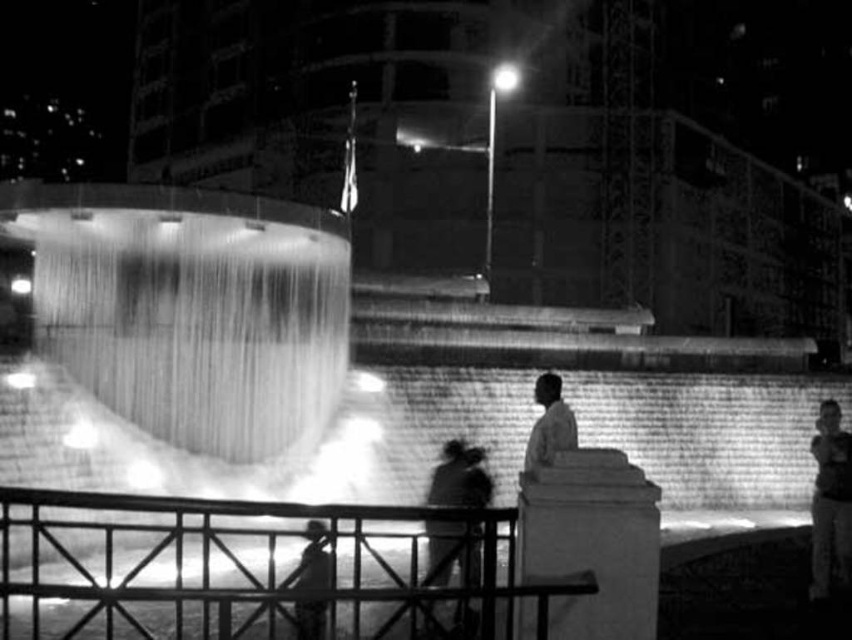
From the picture: Is translucent glass water at center smaller than smooth skin face at right?

Yes.

What do you see at coordinates (191, 308) in the screenshot? I see `translucent glass water at center` at bounding box center [191, 308].

Who is more forward, (x=125, y=385) or (x=827, y=477)?

Point (x=827, y=477) is more forward.

The height and width of the screenshot is (640, 852). In order to click on translucent glass water at center in this screenshot , I will do `click(191, 308)`.

Does smooth skin face at right appear over silhouette fabric at lower center?

Indeed, smooth skin face at right is positioned over silhouette fabric at lower center.

Does smooth skin face at right appear under silhouette fabric at lower center?

Incorrect, smooth skin face at right is not positioned below silhouette fabric at lower center.

The image size is (852, 640). Describe the element at coordinates (830, 500) in the screenshot. I see `smooth skin face at right` at that location.

Locate an element on the screen. Image resolution: width=852 pixels, height=640 pixels. smooth skin face at right is located at coordinates (830, 500).

Is the position of translucent glass water at center more distant than that of light brown leather jacket at center?

Yes, translucent glass water at center is behind light brown leather jacket at center.

Between point (174, 259) and point (551, 397), which one is positioned behind?

The point (174, 259) is more distant.

Locate an element on the screen. The height and width of the screenshot is (640, 852). translucent glass water at center is located at coordinates (191, 308).